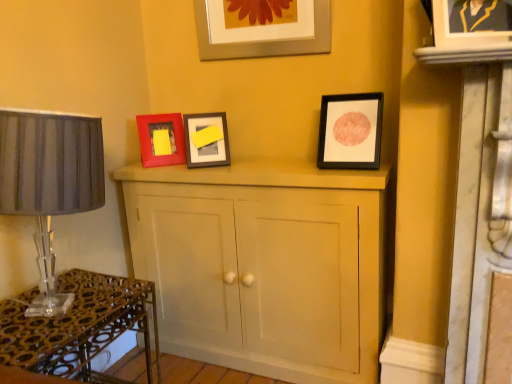
Question: Is matte black picture frame at upper right, which is the second picture frame in right-to-left order, not near metallic silver picture frame at upper center, the second picture frame from the left?

Choices:
 (A) no
 (B) yes

Answer: (A)

Question: Does matte black picture frame at upper right, arranged as the third picture frame when viewed from the back, come behind metallic silver picture frame at upper center, placed as the 3th picture frame when sorted from right to left?

Choices:
 (A) no
 (B) yes

Answer: (A)

Question: From the image's perspective, would you say matte black picture frame at upper right, arranged as the third picture frame when viewed from the back, is positioned over metallic silver picture frame at upper center, the second picture frame from the left?

Choices:
 (A) no
 (B) yes

Answer: (A)

Question: From a real-world perspective, does matte black picture frame at upper right, arranged as the third picture frame when viewed from the back, stand above metallic silver picture frame at upper center, the second picture frame from the back?

Choices:
 (A) no
 (B) yes

Answer: (A)

Question: Is matte black picture frame at upper right, arranged as the third picture frame when viewed from the back, oriented away from metallic silver picture frame at upper center, which is the 3th picture frame from front to back?

Choices:
 (A) yes
 (B) no

Answer: (B)

Question: Is point (320, 117) closer or farther from the camera than point (160, 137)?

Choices:
 (A) farther
 (B) closer

Answer: (B)

Question: Looking at the image, does matte black picture frame at upper right, the 3th picture frame positioned from the left, seem bigger or smaller compared to matte red picture frame at center left, which is the 4th picture frame from right to left?

Choices:
 (A) big
 (B) small

Answer: (B)

Question: Considering the positions of matte black picture frame at upper right, which is the second picture frame in right-to-left order, and matte red picture frame at center left, marked as the 1th picture frame in a back-to-front arrangement, in the image, is matte black picture frame at upper right, which is the second picture frame in right-to-left order, taller or shorter than matte red picture frame at center left, marked as the 1th picture frame in a back-to-front arrangement,?

Choices:
 (A) tall
 (B) short

Answer: (A)

Question: From the image's perspective, relative to matte red picture frame at center left, which is the 1th picture frame in left-to-right order, is matte black picture frame at upper right, arranged as the third picture frame when viewed from the back, above or below?

Choices:
 (A) above
 (B) below

Answer: (B)

Question: From the image's perspective, relative to matte gray lampshade at left, is matte red picture frame at center left, which is the 1th picture frame in left-to-right order, above or below?

Choices:
 (A) below
 (B) above

Answer: (B)

Question: From their relative heights in the image, would you say matte red picture frame at center left, which appears as the fourth picture frame when viewed from the front, is taller or shorter than matte gray lampshade at left?

Choices:
 (A) short
 (B) tall

Answer: (A)

Question: Is matte red picture frame at center left, which appears as the fourth picture frame when viewed from the front, to the left or to the right of matte gray lampshade at left in the image?

Choices:
 (A) left
 (B) right

Answer: (B)

Question: Is matte red picture frame at center left, which appears as the fourth picture frame when viewed from the front, in front of or behind matte gray lampshade at left in the image?

Choices:
 (A) front
 (B) behind

Answer: (B)

Question: Would you say matte gray lampshade at left is to the left or to the right of matte wooden cupboard at center in the picture?

Choices:
 (A) right
 (B) left

Answer: (B)

Question: Is matte gray lampshade at left wider or thinner than matte wooden cupboard at center?

Choices:
 (A) wide
 (B) thin

Answer: (A)